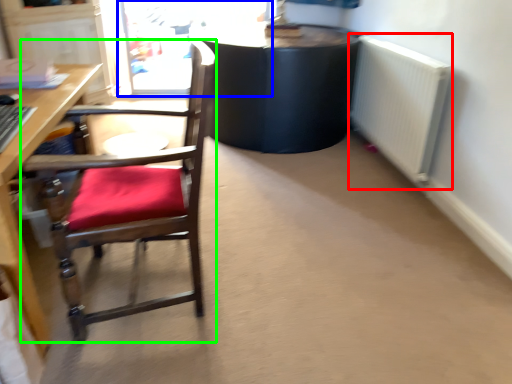
Question: Considering the real-world distances, which object is farthest from radiator (highlighted by a red box)? screen door (highlighted by a blue box) or chair (highlighted by a green box)?

Choices:
 (A) screen door
 (B) chair

Answer: (A)